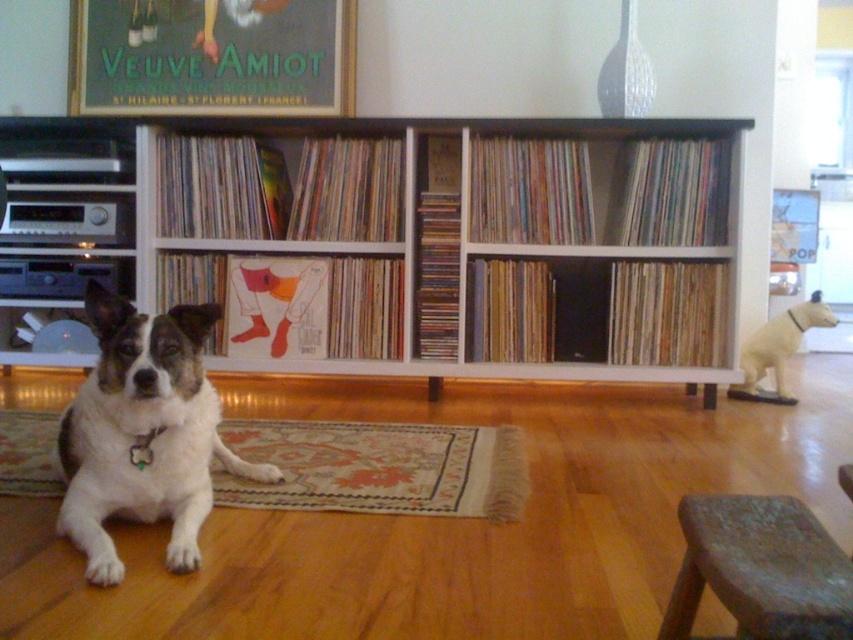
Question: In this image, where is white wood bookcase at center located relative to white fur dog at center?

Choices:
 (A) above
 (B) below

Answer: (A)

Question: Is white fur dog at center above wooden stool at lower right?

Choices:
 (A) no
 (B) yes

Answer: (B)

Question: Among these objects, which one is farthest from the camera?

Choices:
 (A) white matte dog at right
 (B) wooden stool at lower right
 (C) white fur dog at center

Answer: (A)

Question: Can you confirm if white wood bookcase at center is wider than white matte dog at right?

Choices:
 (A) no
 (B) yes

Answer: (B)

Question: Which object is closer to the camera taking this photo?

Choices:
 (A) wooden stool at lower right
 (B) white fur dog at center

Answer: (A)

Question: Estimate the real-world distances between objects in this image. Which object is closer to the wooden stool at lower right?

Choices:
 (A) white wood bookcase at center
 (B) white fur dog at center

Answer: (B)